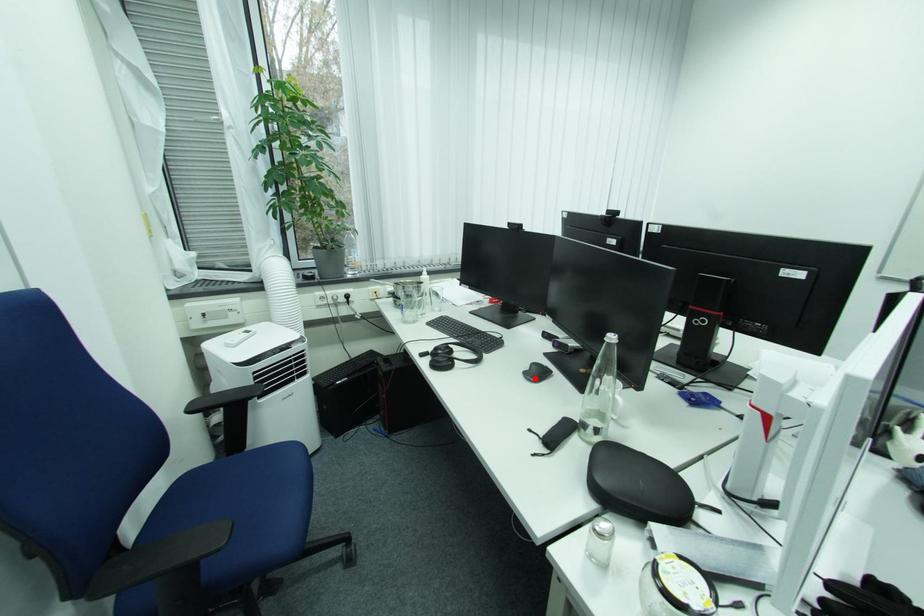
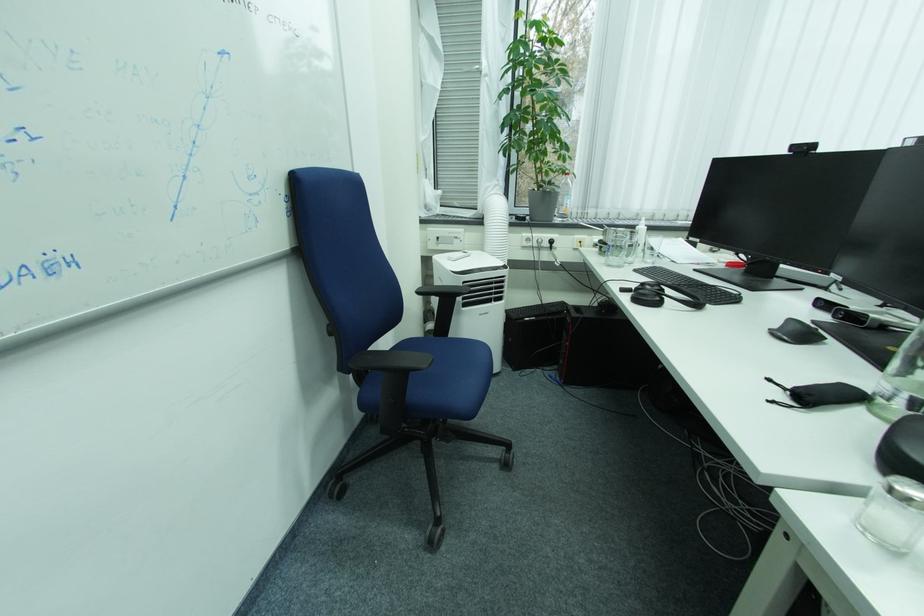
Locate, in the second image, the point that corresponds to the highlighted location in the first image.

(785, 334)